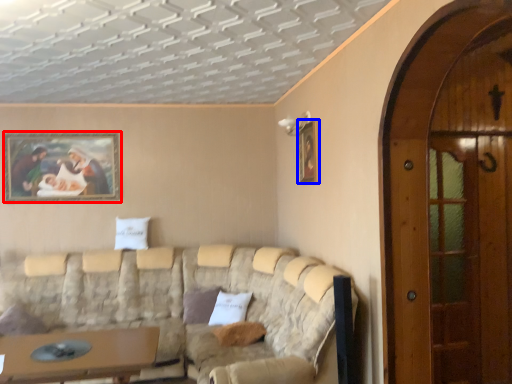
Question: Which of the following is the farthest to the observer, picture frame (highlighted by a red box) or picture frame (highlighted by a blue box)?

Choices:
 (A) picture frame
 (B) picture frame

Answer: (A)